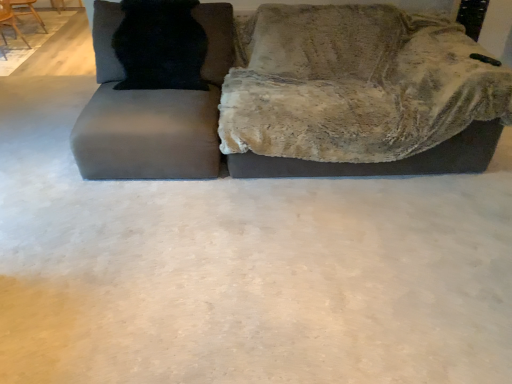
Question: Is matte gray swivel chair at left next to black fur cat at upper left and touching it?

Choices:
 (A) yes
 (B) no

Answer: (B)

Question: Is matte gray swivel chair at left oriented towards black fur cat at upper left?

Choices:
 (A) no
 (B) yes

Answer: (B)

Question: Is matte gray swivel chair at left bigger than black fur cat at upper left?

Choices:
 (A) yes
 (B) no

Answer: (A)

Question: Is matte gray swivel chair at left smaller than black fur cat at upper left?

Choices:
 (A) yes
 (B) no

Answer: (B)

Question: Considering the relative positions of matte gray swivel chair at left and black fur cat at upper left in the image provided, is matte gray swivel chair at left in front of black fur cat at upper left?

Choices:
 (A) yes
 (B) no

Answer: (A)

Question: Is matte gray swivel chair at left far from black fur cat at upper left?

Choices:
 (A) yes
 (B) no

Answer: (B)

Question: From the image's perspective, is velvet gray couch at upper center located above wooden chair at upper left, the second chair from the back?

Choices:
 (A) no
 (B) yes

Answer: (A)

Question: Can you confirm if velvet gray couch at upper center is bigger than wooden chair at upper left, the second chair from the back?

Choices:
 (A) yes
 (B) no

Answer: (A)

Question: Is velvet gray couch at upper center not inside wooden chair at upper left, which ranks as the 1th chair in front-to-back order?

Choices:
 (A) no
 (B) yes

Answer: (B)

Question: Does velvet gray couch at upper center have a greater width compared to wooden chair at upper left, which ranks as the 1th chair in front-to-back order?

Choices:
 (A) yes
 (B) no

Answer: (A)

Question: Is velvet gray couch at upper center closer to the viewer compared to wooden chair at upper left, which ranks as the 1th chair in front-to-back order?

Choices:
 (A) no
 (B) yes

Answer: (B)

Question: Is velvet gray couch at upper center facing towards wooden chair at upper left, the second chair from the back?

Choices:
 (A) yes
 (B) no

Answer: (B)

Question: Does matte gray swivel chair at left have a smaller size compared to velvet gray couch at upper center?

Choices:
 (A) no
 (B) yes

Answer: (B)